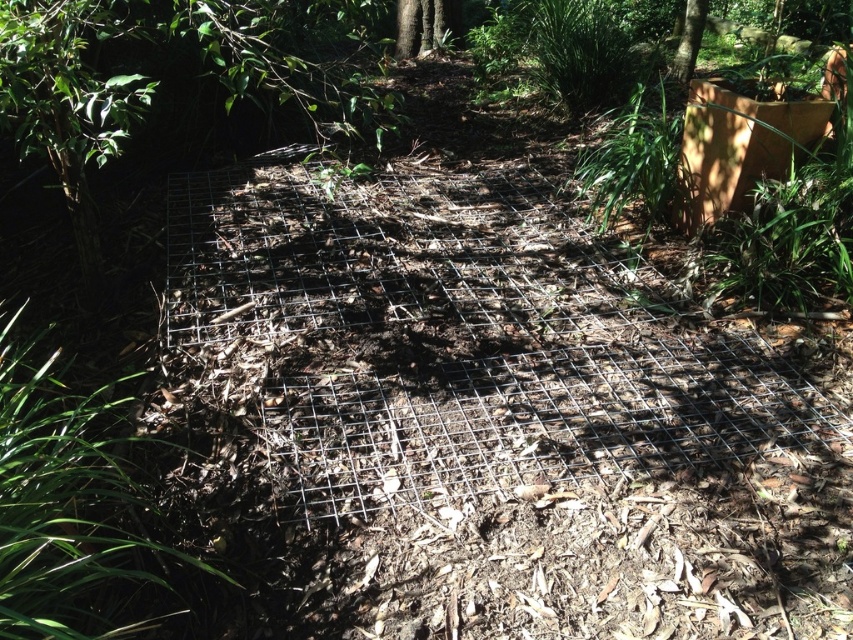
You are standing in the garden looking at the metal grid structure. There are two points marked on the grid, one at coordinates point (144,620) and the other at point (686,52). Which of these points is nearer to you?

Point (144,620) is closer to the viewer than point (686,52).

You are a gardener who needs to place a 1 meter long garden tool between the green grass at lower left and the metal grid structure. Can you fit it there?

The distance between the green grass at lower left and the metal grid structure is 1.19 meters, so yes, the 1 meter long garden tool can be placed there as there is enough space.